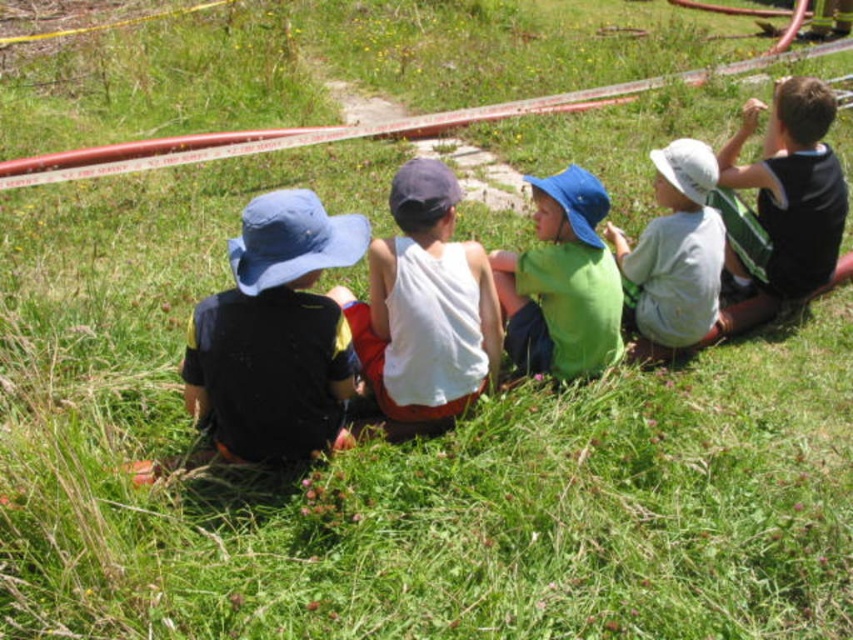
Between black jersey at upper right and white cotton shirt at center, which one is positioned higher?

black jersey at upper right is above.

Describe the element at coordinates (784, 193) in the screenshot. The width and height of the screenshot is (853, 640). I see `black jersey at upper right` at that location.

Is point (825, 164) closer to viewer compared to point (682, 339)?

No.

Where is `black jersey at upper right`? black jersey at upper right is located at coordinates (784, 193).

Consider the image. Can you confirm if green matte shirt at center is wider than white cotton shirt at center?

No.

Is point (512, 276) more distant than point (683, 193)?

No.

Find the location of a particular element. green matte shirt at center is located at coordinates (561, 282).

Measure the distance from matte blue hat at left to white cotton tank top at center.

matte blue hat at left and white cotton tank top at center are 38.69 centimeters apart.

Is point (276, 288) farther from camera compared to point (445, 230)?

That is False.

Find the location of a particular element. This screenshot has height=640, width=853. matte blue hat at left is located at coordinates (276, 333).

The image size is (853, 640). What are the coordinates of `matte blue hat at left` in the screenshot? It's located at (276, 333).